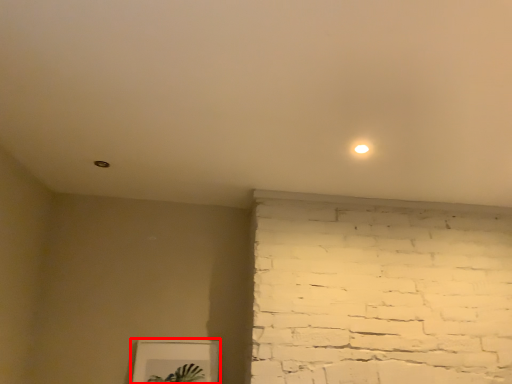
Question: From the image's perspective, what is the correct spatial positioning of picture frame (annotated by the red box) in reference to light?

Choices:
 (A) below
 (B) above

Answer: (A)